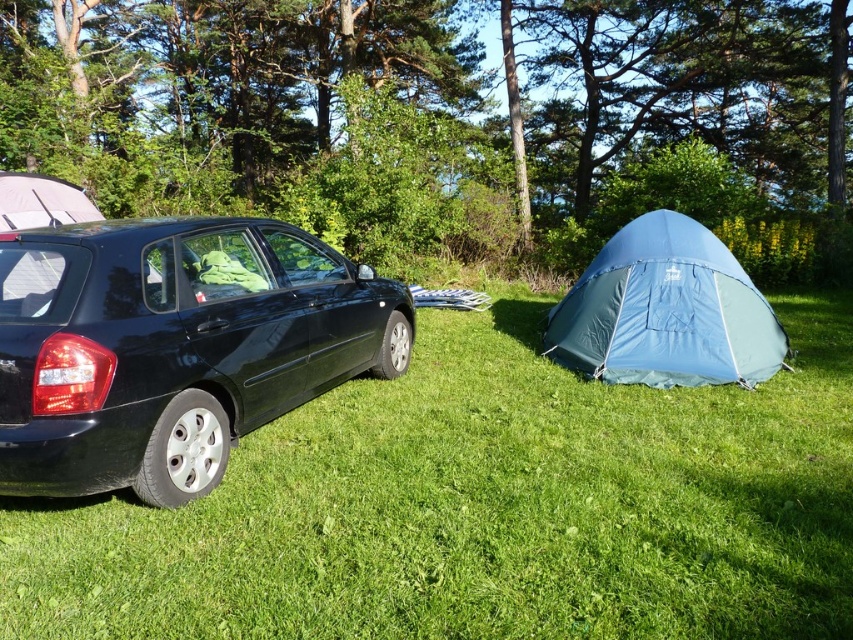
Can you confirm if green grass at lower left is shorter than blue fabric tent at right?

Correct, green grass at lower left is not as tall as blue fabric tent at right.

Which is behind, point (444, 429) or point (735, 307)?

Positioned behind is point (735, 307).

At what (x,y) coordinates should I click in order to perform the action: click on green grass at lower left. Please return your answer as a coordinate pair (x, y). This screenshot has width=853, height=640. Looking at the image, I should click on (483, 506).

Is point (209, 468) positioned before point (68, 196)?

Yes, point (209, 468) is in front of point (68, 196).

I want to click on glossy black car at left, so click(x=173, y=346).

Describe the element at coordinates (173, 346) in the screenshot. The height and width of the screenshot is (640, 853). I see `glossy black car at left` at that location.

Locate an element on the screen. Image resolution: width=853 pixels, height=640 pixels. glossy black car at left is located at coordinates (173, 346).

Looking at this image, is blue fabric tent at right wider than matte gray tent at left?

Indeed, blue fabric tent at right has a greater width compared to matte gray tent at left.

Who is positioned more to the right, blue fabric tent at right or matte gray tent at left?

Positioned to the right is blue fabric tent at right.

Locate an element on the screen. blue fabric tent at right is located at coordinates (665, 310).